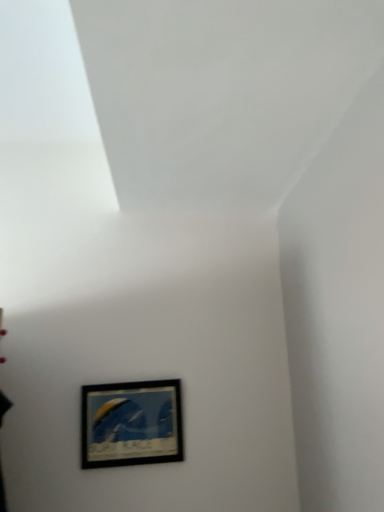
The height and width of the screenshot is (512, 384). What do you see at coordinates (131, 424) in the screenshot?
I see `black matte picture frame at lower center` at bounding box center [131, 424].

This screenshot has width=384, height=512. What are the coordinates of `black matte picture frame at lower center` in the screenshot? It's located at (131, 424).

At what (x,y) coordinates should I click in order to perform the action: click on black matte picture frame at lower center. Please return your answer as a coordinate pair (x, y). Looking at the image, I should click on (131, 424).